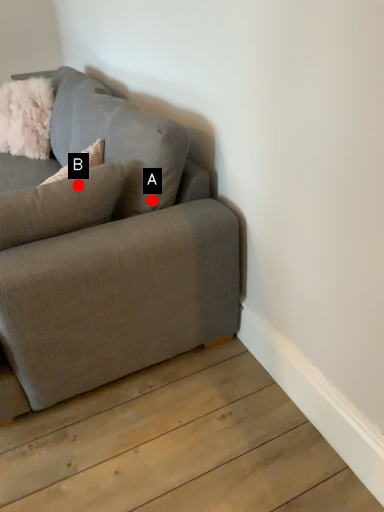
Question: Two points are circled on the image, labeled by A and B beside each circle. Which point is closer to the camera?

Choices:
 (A) A is closer
 (B) B is closer

Answer: (B)